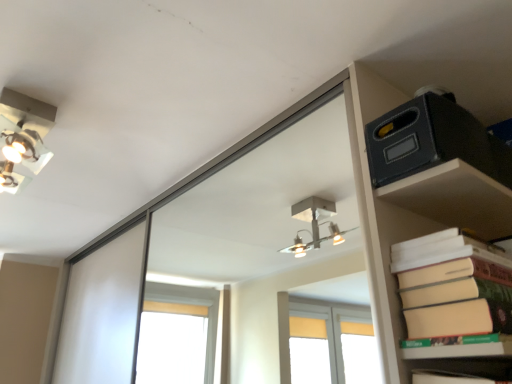
Question: Do you think beige matte paper at right is within matte black box at upper right, or outside of it?

Choices:
 (A) inside
 (B) outside

Answer: (B)

Question: From a real-world perspective, is beige matte paper at right above or below matte black box at upper right?

Choices:
 (A) below
 (B) above

Answer: (A)

Question: Which of these objects is positioned farthest from the metallic silver light fixture at upper left?

Choices:
 (A) matte black box at upper right
 (B) beige matte paper at right

Answer: (B)

Question: Estimate the real-world distances between objects in this image. Which object is closer to the metallic silver light fixture at upper left?

Choices:
 (A) matte black box at upper right
 (B) beige matte paper at right

Answer: (A)